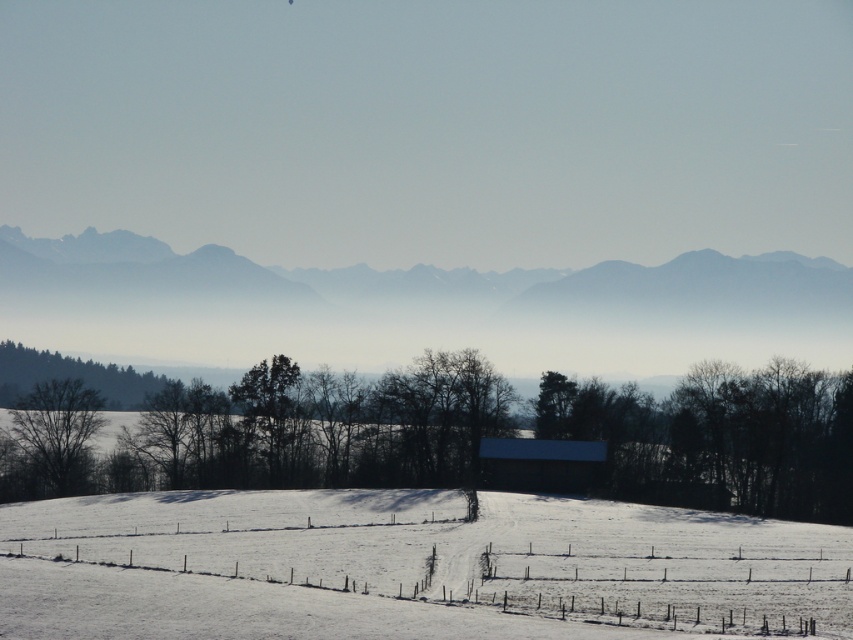
Question: Is gray foggy mountain at center to the right of white wooden fence at lower center from the viewer's perspective?

Choices:
 (A) yes
 (B) no

Answer: (B)

Question: Can you confirm if gray foggy mountain at center is smaller than white wooden fence at lower center?

Choices:
 (A) no
 (B) yes

Answer: (A)

Question: Among these objects, which one is nearest to the camera?

Choices:
 (A) bare wood tree at left
 (B) smooth brown tree at center

Answer: (B)

Question: Is gray foggy mountain at center positioned before bare wood tree at left?

Choices:
 (A) yes
 (B) no

Answer: (B)

Question: Which of these objects is positioned closest to the bare wood tree at left?

Choices:
 (A) gray foggy mountain at center
 (B) white wooden fence at lower center
 (C) smooth brown tree at center

Answer: (C)

Question: Which point is closer to the camera?

Choices:
 (A) (310, 408)
 (B) (61, 602)

Answer: (B)